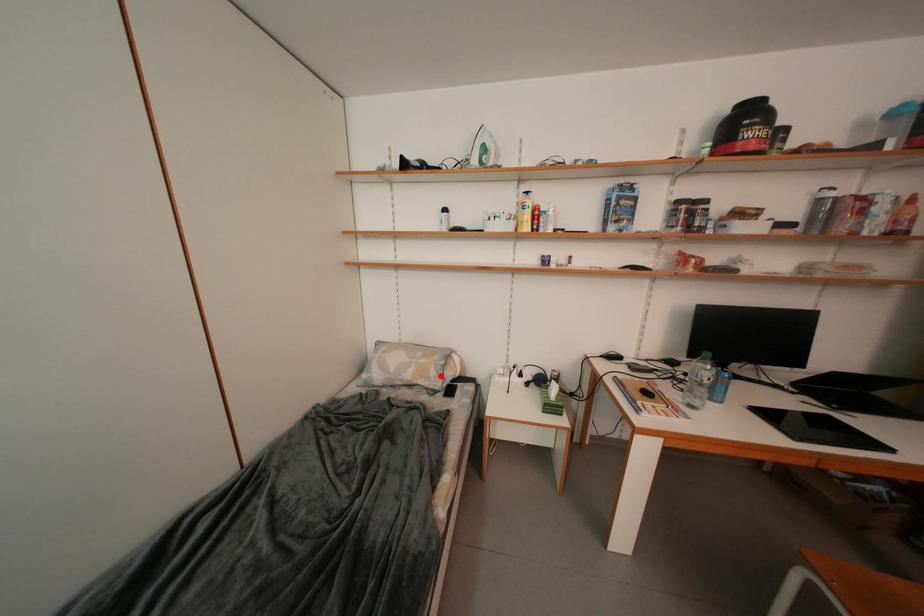
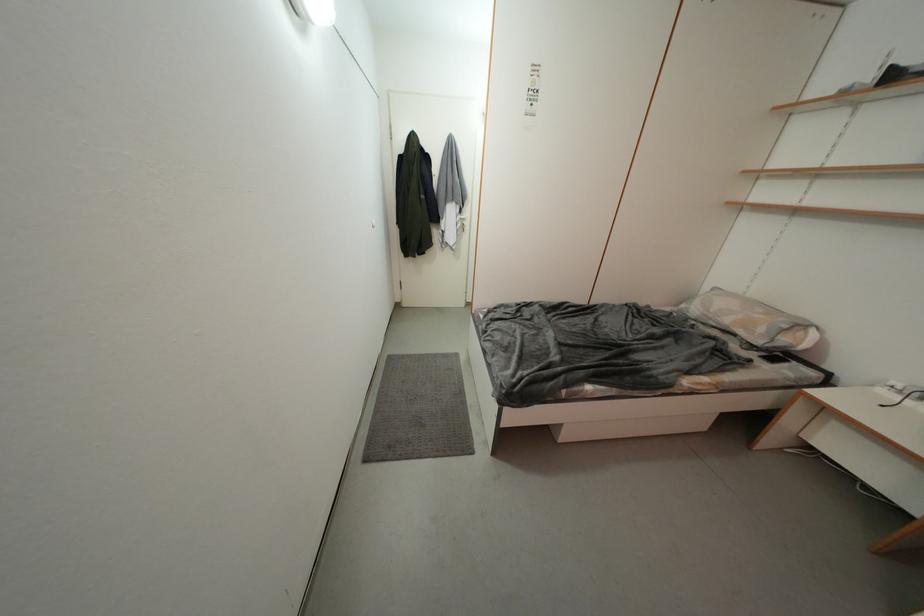
Locate, in the second image, the point that corresponds to the highlighted location in the first image.

(769, 333)